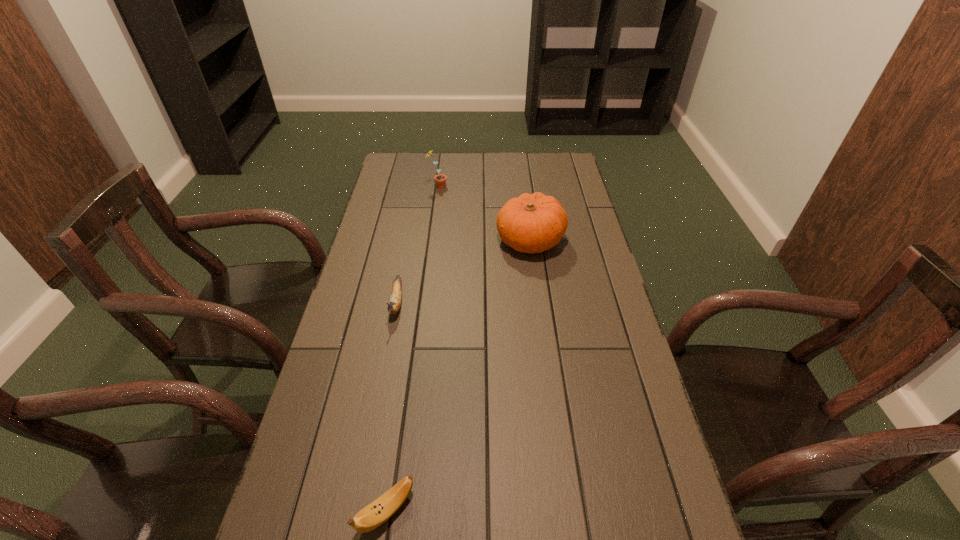
This screenshot has width=960, height=540. What are the coordinates of `vacant region at the left edge of the desktop` in the screenshot? It's located at (317, 537).

In the image, there is a desktop. In order to click on vacant space at the right edge in this screenshot , I will do `click(633, 538)`.

The image size is (960, 540). Identify the location of vacant space at the far left corner of the desktop. point(394,167).

Locate an element on the screen. blank space at the far right corner of the desktop is located at coordinates (569, 164).

Locate an element on the screen. vacant space that's between the sunflower and the farther banana is located at coordinates (x=417, y=245).

In order to click on blank region between the second farthest object and the farther banana in this screenshot , I will do `click(464, 272)`.

The image size is (960, 540). Identify the location of free space between the second nearest object and the sunflower. (417, 245).

The width and height of the screenshot is (960, 540). I want to click on free space between the third nearest object and the farthest object, so click(484, 214).

Where is `object that stands as the closest to the sunflower`? The height and width of the screenshot is (540, 960). object that stands as the closest to the sunflower is located at coordinates (532, 223).

Choose which object is the nearest neighbor to the nearest object. Please provide its 2D coordinates. Your answer should be formatted as a tuple, i.e. [(x, y)], where the tuple contains the x and y coordinates of a point satisfying the conditions above.

[(396, 295)]